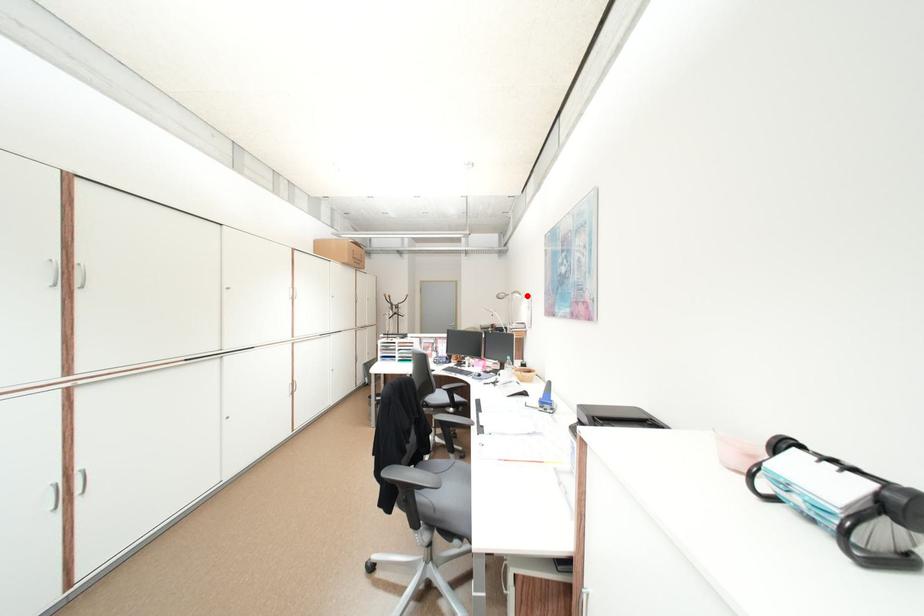
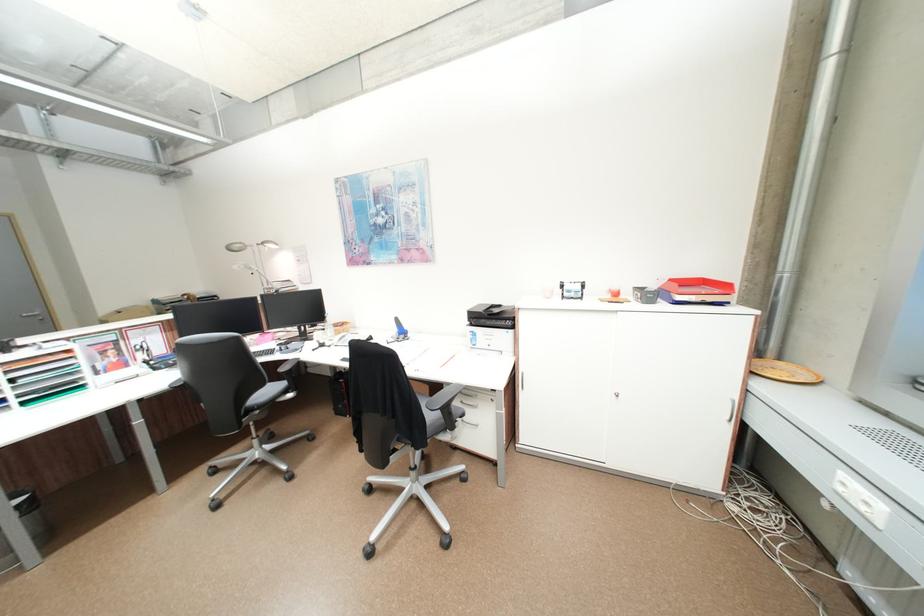
Find the pixel in the second image that matches the highlighted location in the first image.

(281, 246)